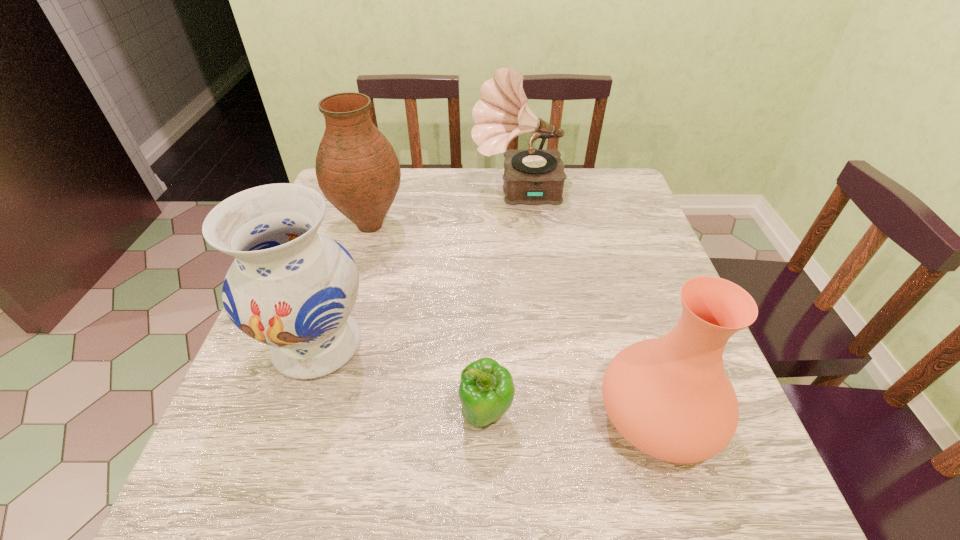
What are the coordinates of `record player` in the screenshot? It's located at (532, 176).

I want to click on the farthest vase, so click(x=357, y=169).

This screenshot has height=540, width=960. Find the location of `the rightmost vase`. the rightmost vase is located at coordinates (670, 397).

The width and height of the screenshot is (960, 540). What are the coordinates of `bell pepper` in the screenshot? It's located at (486, 391).

Locate an element on the screen. This screenshot has height=540, width=960. vacant space located from the horn of the record player is located at coordinates [x=401, y=192].

Locate an element on the screen. free space located from the horn of the record player is located at coordinates (395, 192).

Locate an element on the screen. This screenshot has height=540, width=960. vacant space situated from the horn of the record player is located at coordinates (431, 192).

Identify the location of free space located on the front of the farthest vase. The image size is (960, 540). (346, 308).

The image size is (960, 540). Identify the location of free location located on the left of the rightmost vase. (569, 417).

The height and width of the screenshot is (540, 960). I want to click on blank space located 0.370m on the left of the shortest object, so click(255, 412).